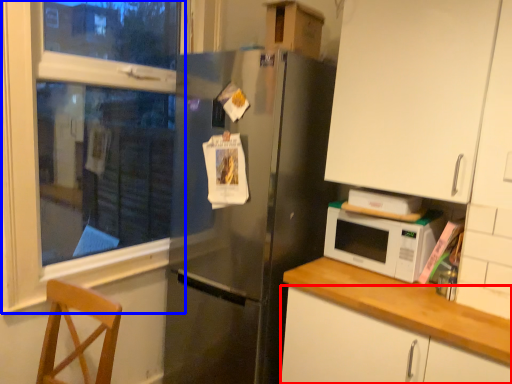
Question: Which object is further to the camera taking this photo, cabinetry (highlighted by a red box) or window frame (highlighted by a blue box)?

Choices:
 (A) cabinetry
 (B) window frame

Answer: (B)